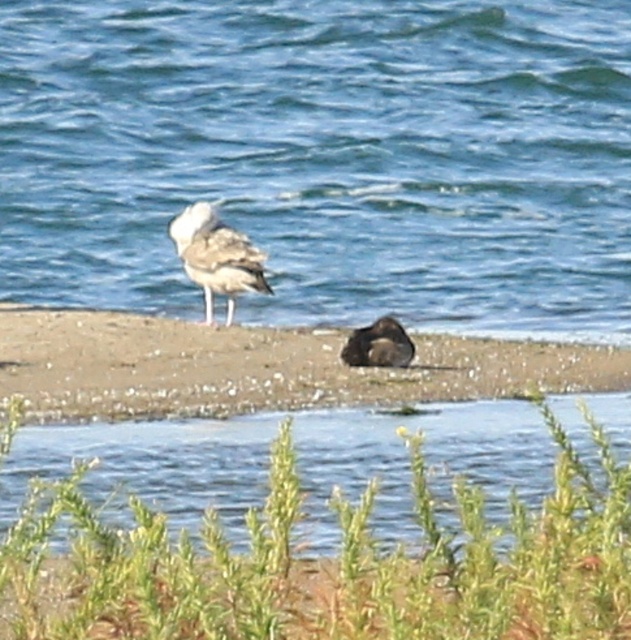
You are a photographer trying to capture a closeup of the brown fuzzy bird at center without the blue water at center taking up too much of the frame. Based on their sizes, which one would you need to zoom in more on to make the bird fill the frame adequately?

The blue water at center is larger in size than the brown fuzzy bird at center, so to make the brown fuzzy bird at center fill the frame, you would need to zoom in more on it since it is smaller compared to the blue water at center.

You are standing at the position marked by point (x=326, y=157) in the image. Based on the scene description, what do you see directly in front of you?

You see blue water at center directly in front of you because the point (x=326, y=157) corresponds to that location.